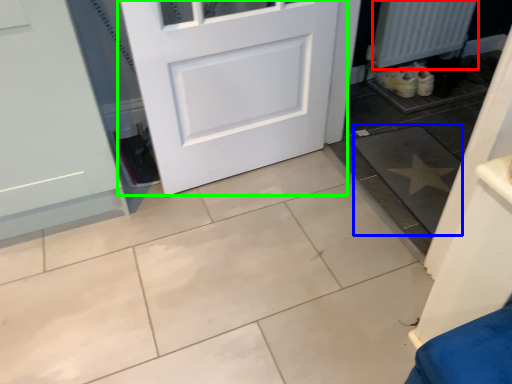
Question: Which is farther away from radiator (highlighted by a red box)? ceramic tile (highlighted by a blue box) or door (highlighted by a green box)?

Choices:
 (A) ceramic tile
 (B) door

Answer: (B)